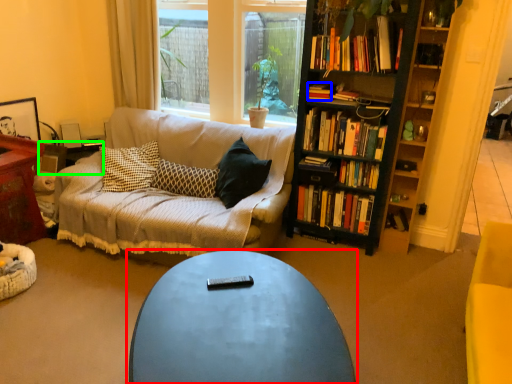
Question: Which is nearer to the coffee table (highlighted by a red box)? book (highlighted by a blue box) or side table (highlighted by a green box).

Choices:
 (A) book
 (B) side table

Answer: (A)